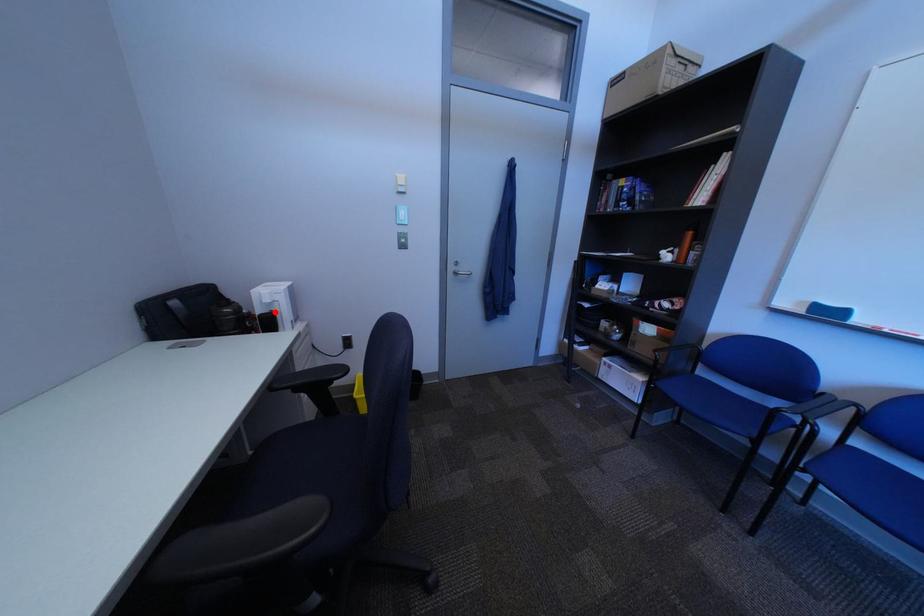
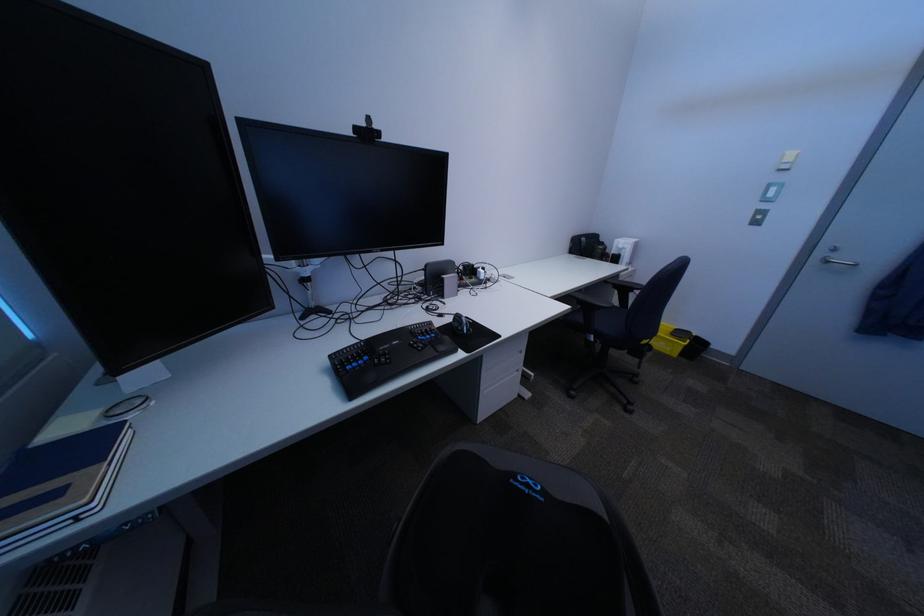
The point at the highlighted location is marked in the first image. Where is the corresponding point in the second image?

(628, 254)